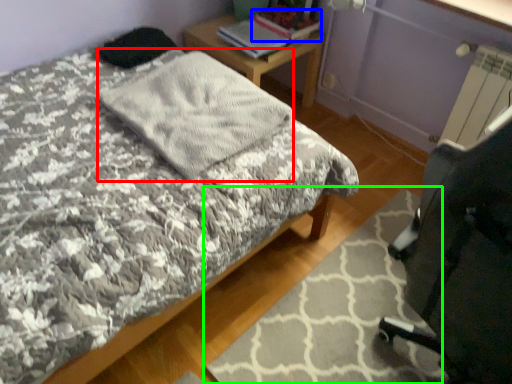
Question: Based on their relative distances, which object is farther from blanket (highlighted by a red box)? Choose from book (highlighted by a blue box) and mat (highlighted by a green box).

Choices:
 (A) book
 (B) mat

Answer: (A)